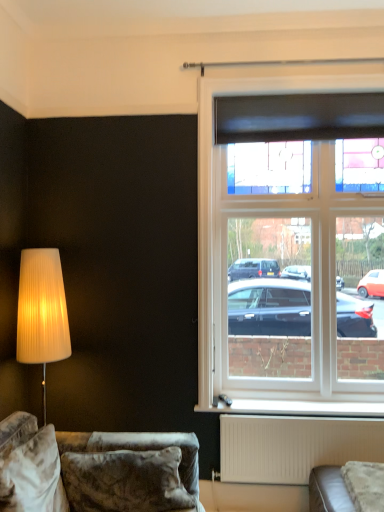
Question: Can we say stained glass window at upper right lies outside white plastic window sill at lower center?

Choices:
 (A) no
 (B) yes

Answer: (B)

Question: Is stained glass window at upper right to the left of white plastic window sill at lower center from the viewer's perspective?

Choices:
 (A) yes
 (B) no

Answer: (A)

Question: Is stained glass window at upper right to the right of white plastic window sill at lower center from the viewer's perspective?

Choices:
 (A) yes
 (B) no

Answer: (B)

Question: Is stained glass window at upper right not close to white plastic window sill at lower center?

Choices:
 (A) no
 (B) yes

Answer: (A)

Question: Does stained glass window at upper right lie behind white plastic window sill at lower center?

Choices:
 (A) no
 (B) yes

Answer: (A)

Question: Is stained glass window at upper right positioned with its back to white plastic window sill at lower center?

Choices:
 (A) yes
 (B) no

Answer: (B)

Question: Is white matte radiator at lower center smaller than velvet couch at lower left?

Choices:
 (A) no
 (B) yes

Answer: (B)

Question: Is white matte radiator at lower center touching velvet couch at lower left?

Choices:
 (A) no
 (B) yes

Answer: (A)

Question: Is white matte radiator at lower center not inside velvet couch at lower left?

Choices:
 (A) yes
 (B) no

Answer: (A)

Question: Is the depth of white matte radiator at lower center less than that of velvet couch at lower left?

Choices:
 (A) yes
 (B) no

Answer: (B)

Question: Can you confirm if white matte radiator at lower center is shorter than velvet couch at lower left?

Choices:
 (A) no
 (B) yes

Answer: (B)

Question: Is white matte radiator at lower center turned away from velvet couch at lower left?

Choices:
 (A) no
 (B) yes

Answer: (A)

Question: Does velvet couch at lower left have a smaller size compared to stained glass window at upper right?

Choices:
 (A) no
 (B) yes

Answer: (A)